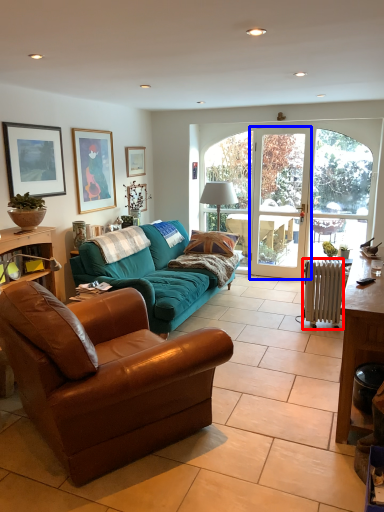
Question: Among these objects, which one is nearest to the camera, radiator (highlighted by a red box) or screen door (highlighted by a blue box)?

Choices:
 (A) radiator
 (B) screen door

Answer: (A)